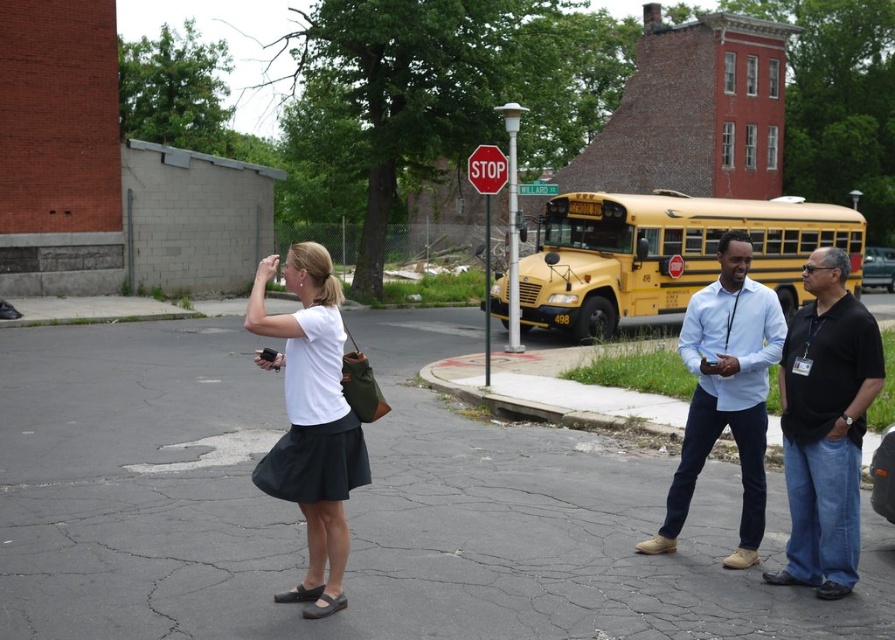
Does black cotton shirt at right appear over red plastic stop sign at upper center?

Actually, black cotton shirt at right is below red plastic stop sign at upper center.

I want to click on black cotton shirt at right, so click(825, 426).

I want to click on black cotton shirt at right, so click(825, 426).

Which of these two, black cotton shirt at right or white shirt at center, stands taller?

white shirt at center

Who is positioned more to the right, black cotton shirt at right or white shirt at center?

Positioned to the right is black cotton shirt at right.

Between point (800, 397) and point (746, 304), which one is positioned behind?

The point (746, 304) is behind.

Identify the location of black cotton shirt at right. (825, 426).

Image resolution: width=895 pixels, height=640 pixels. Describe the element at coordinates (726, 392) in the screenshot. I see `white shirt at center` at that location.

Is white shirt at center below red plastic stop sign at upper center?

Yes, white shirt at center is below red plastic stop sign at upper center.

At what (x,y) coordinates should I click in order to perform the action: click on white shirt at center. Please return your answer as a coordinate pair (x, y). This screenshot has width=895, height=640. Looking at the image, I should click on (726, 392).